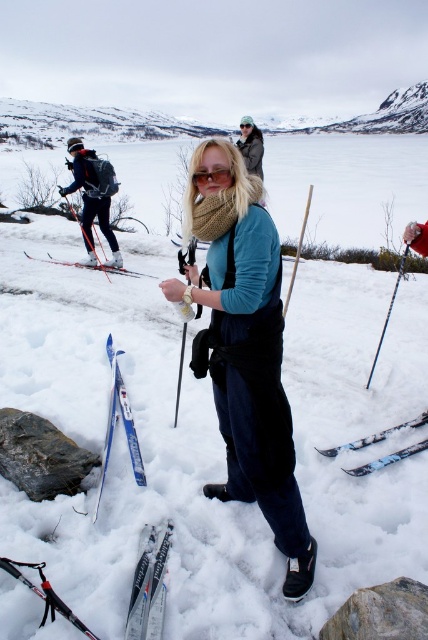
Consider the image. You are trying to determine if the light brown fur coat at center can completely cover the matte black goggles at center when placed over them. Based on their sizes, is this possible?

The light brown fur coat at center might be wider than matte black goggles at center, so it is possible that the light brown fur coat at center can completely cover the matte black goggles at center when placed over them.

You are standing at the point with coordinates point (410, 221) and want to move towards the point with coordinates point (23, 579). Which direction should you move to reach the other point?

You should move forward because point (23, 579) is in front of point (410, 221).

You are navigating through the snowy area and want to reach the point marked as point (244,156). There is an obstacle at point (252,124). Will you encounter the obstacle before reaching your destination?

Point (244,156) is in front of point (252,124), so you will reach the destination before encountering the obstacle.